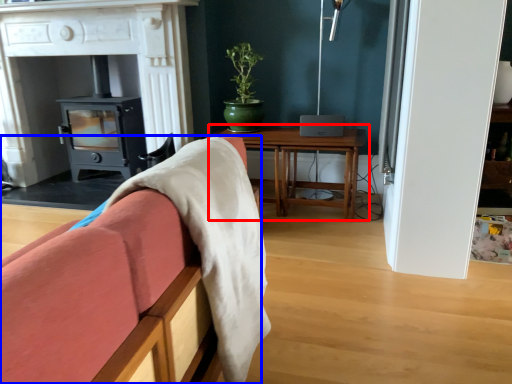
Question: Which object appears closest to the camera in this image, table (highlighted by a red box) or furniture (highlighted by a blue box)?

Choices:
 (A) table
 (B) furniture

Answer: (B)